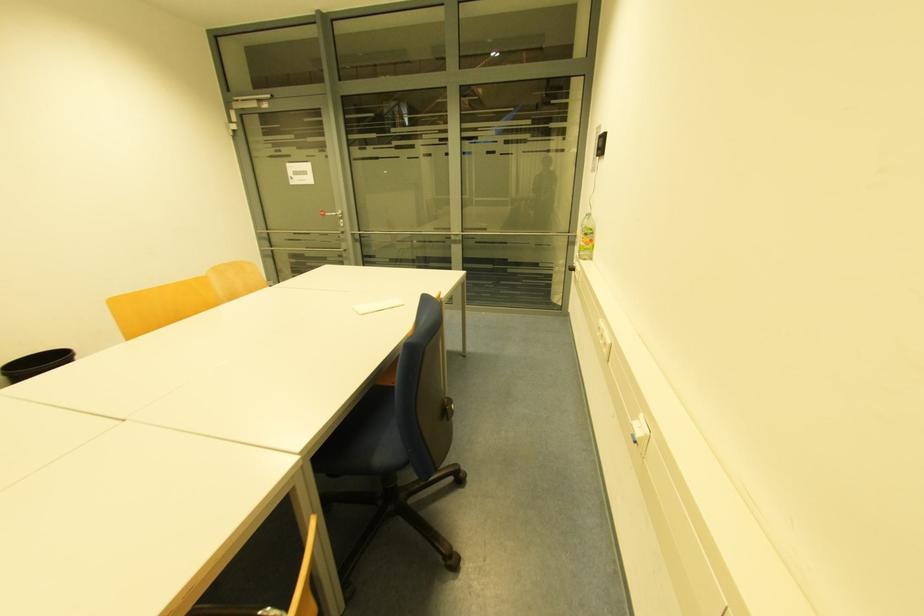
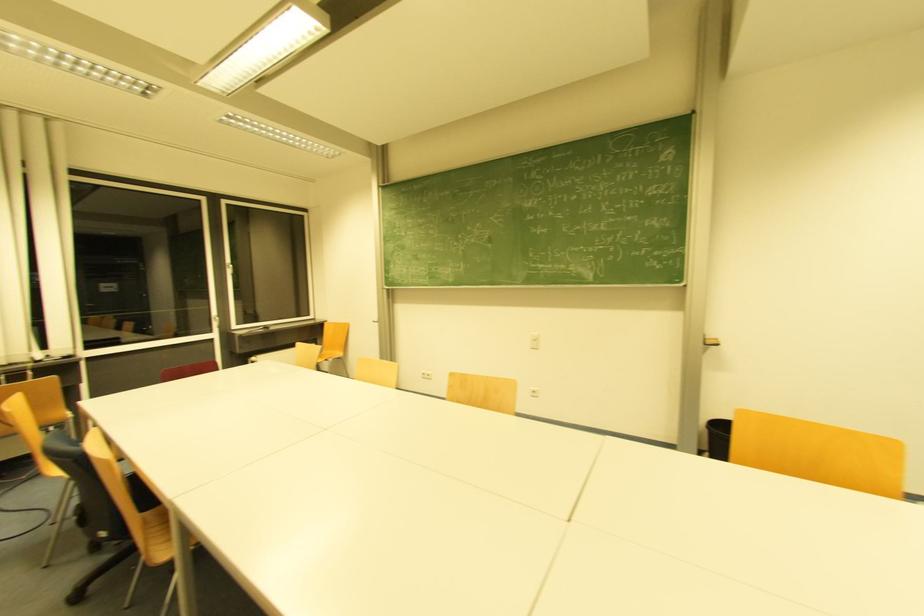
Question: The camera is either moving clockwise (left) or counter-clockwise (right) around the object. The first image is from the beginning of the video and the second image is from the end. Is the camera moving left or right when shooting the video?

Choices:
 (A) Left
 (B) Right

Answer: (B)